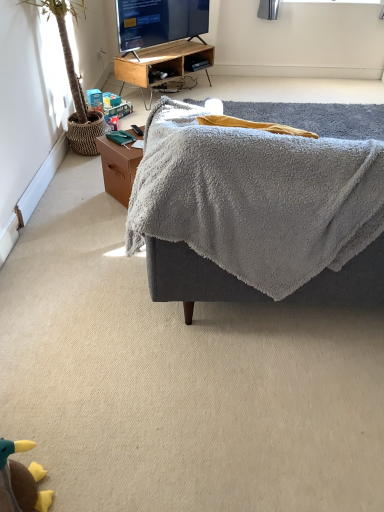
Locate an element on the screen. The width and height of the screenshot is (384, 512). vacant space in between gray fuzzy ottoman at center and plush yellow duck at lower left is located at coordinates (182, 384).